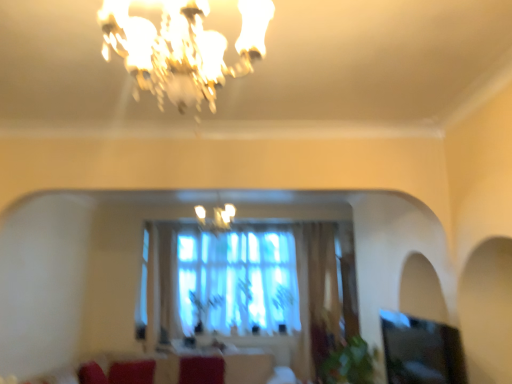
Question: Considering the positions of point (413, 327) and point (227, 354), is point (413, 327) closer or farther from the camera than point (227, 354)?

Choices:
 (A) farther
 (B) closer

Answer: (B)

Question: Looking at the image, does transparent glass window screen at lower right seem bigger or smaller compared to wooden round table at center?

Choices:
 (A) small
 (B) big

Answer: (A)

Question: Estimate the real-world distances between objects in this image. Which object is farther from the velvet maroon swivel chair at center?

Choices:
 (A) wooden round table at center
 (B) velvet red couch at lower center
 (C) matte glass chandelier at center, positioned as the first lamp in back-to-front order
 (D) gold crystal chandelier at upper center, which ranks as the first lamp in front-to-back order
 (E) transparent glass window screen at lower right

Answer: (D)

Question: Which object is positioned farthest from the wooden round table at center?

Choices:
 (A) velvet red couch at lower center
 (B) matte glass chandelier at center, arranged as the second lamp when viewed from the top
 (C) gold crystal chandelier at upper center, which is the 1th lamp from top to bottom
 (D) transparent glass window screen at lower right
 (E) velvet maroon swivel chair at center

Answer: (C)